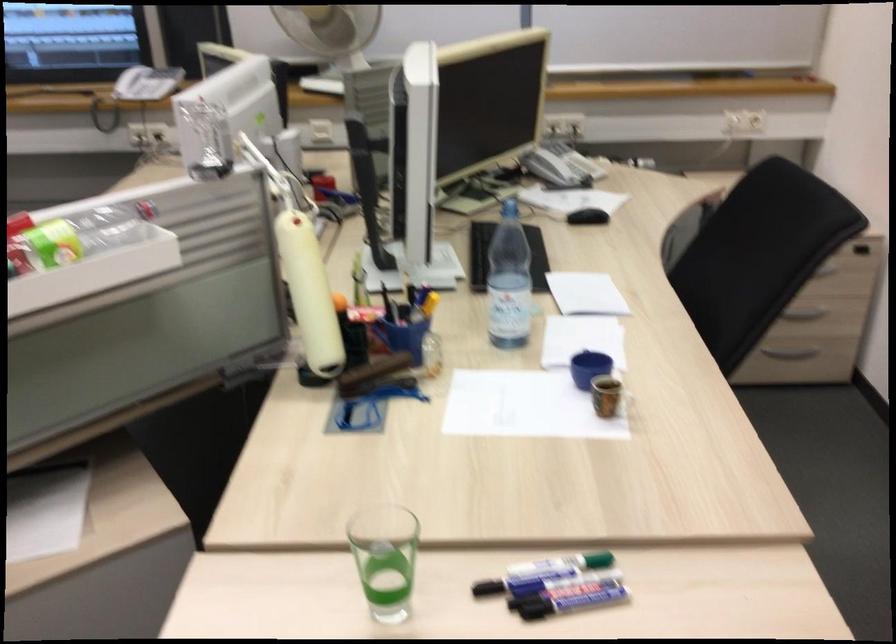
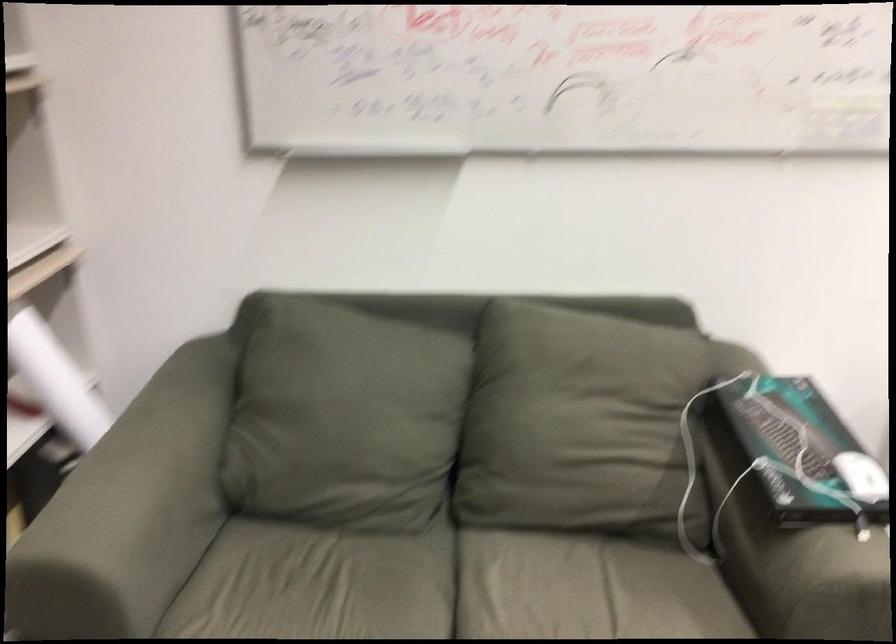
In the scene shown: The images are taken continuously from a first-person perspective. In which direction is your viewpoint rotating?

The camera rotated toward left-down.